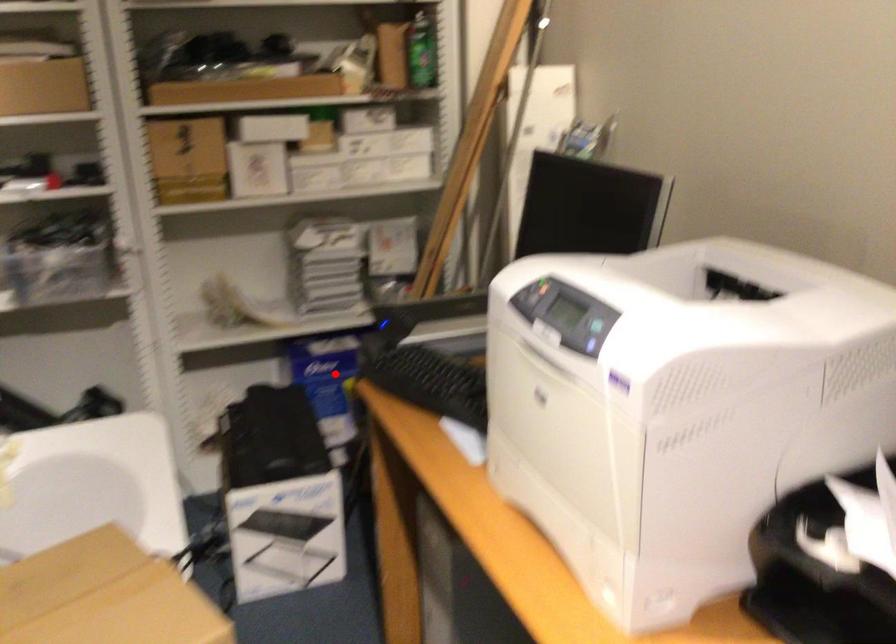
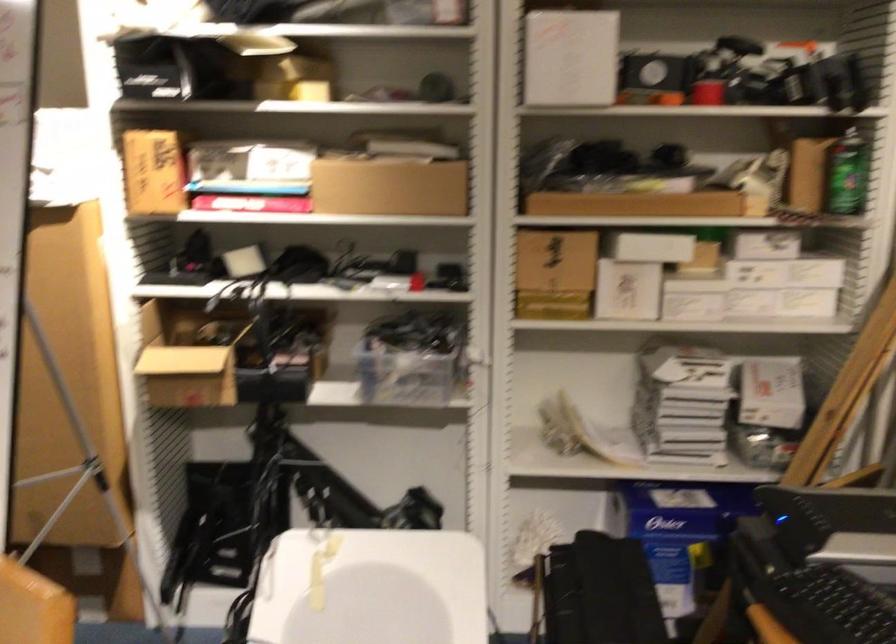
Question: A red point is marked in image1. In image2, is the corresponding 3D point closer to the camera or farther? Reply with the corresponding letter.

Choices:
 (A) The corresponding 3D point is closer.
 (B) The corresponding 3D point is farther.

Answer: (A)